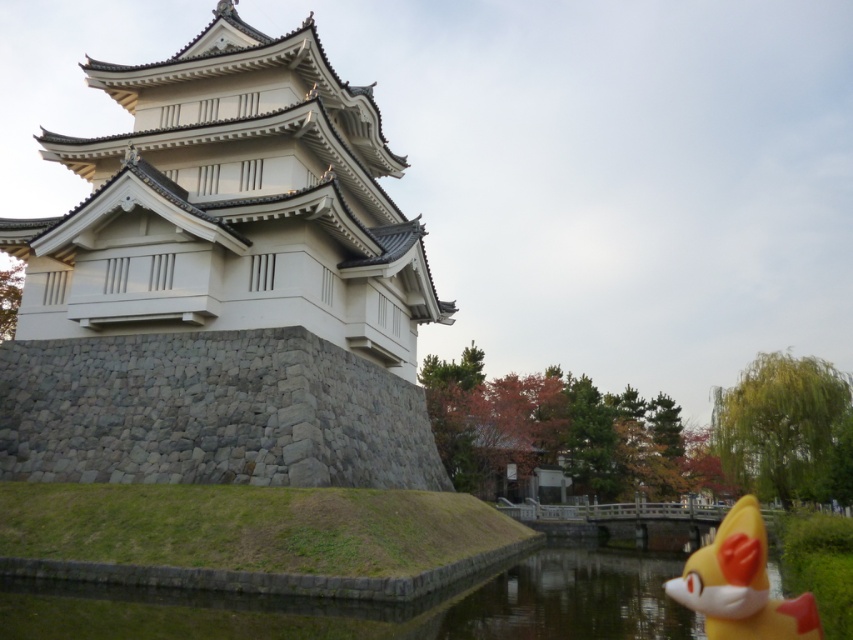
Question: Which object is closer to the camera taking this photo?

Choices:
 (A) yellow matte fox at lower right
 (B) white stone tower at center
 (C) clear water at lower center

Answer: (A)

Question: Can you confirm if white stone tower at center is wider than clear water at lower center?

Choices:
 (A) yes
 (B) no

Answer: (B)

Question: Which point is closer to the camera?

Choices:
 (A) clear water at lower center
 (B) yellow matte fox at lower right
 (C) white stone tower at center

Answer: (B)

Question: Can you confirm if white stone tower at center is wider than yellow matte fox at lower right?

Choices:
 (A) yes
 (B) no

Answer: (A)

Question: Observing the image, what is the correct spatial positioning of white stone tower at center in reference to yellow matte fox at lower right?

Choices:
 (A) left
 (B) right

Answer: (A)

Question: Among these objects, which one is nearest to the camera?

Choices:
 (A) white stone tower at center
 (B) yellow matte fox at lower right
 (C) clear water at lower center

Answer: (B)